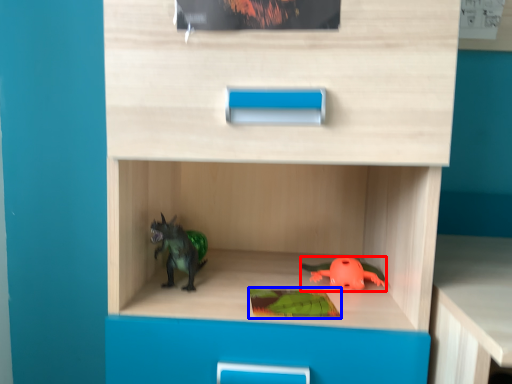
Question: Which point is closer to the camera, toy (highlighted by a red box) or paperback book (highlighted by a blue box)?

Choices:
 (A) toy
 (B) paperback book

Answer: (B)